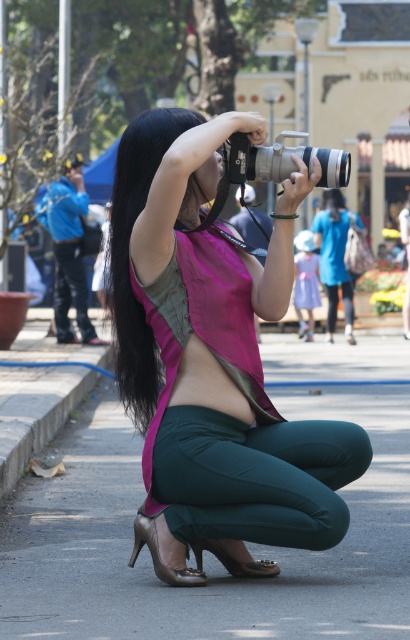
Does pink matte vest at center appear on the left side of blue denim jeans at center?

Yes, pink matte vest at center is to the left of blue denim jeans at center.

Is pink matte vest at center thinner than blue denim jeans at center?

In fact, pink matte vest at center might be wider than blue denim jeans at center.

Locate an element on the screen. This screenshot has width=410, height=640. pink matte vest at center is located at coordinates (211, 362).

Is blue denim jeans at center bigger than purple satin dress at upper center?

Yes, blue denim jeans at center is bigger than purple satin dress at upper center.

Which of these two, blue denim jeans at center or purple satin dress at upper center, stands shorter?

purple satin dress at upper center

The image size is (410, 640). Describe the element at coordinates (334, 259) in the screenshot. I see `blue denim jeans at center` at that location.

Find the location of a particular element. This screenshot has height=640, width=410. blue denim jeans at center is located at coordinates (334, 259).

Can you confirm if concrete at lower left is wider than purple satin dress at upper center?

Yes.

Is point (32, 420) farther from camera compared to point (309, 282)?

No.

Between point (16, 467) and point (312, 323), which one is positioned behind?

The point (312, 323) is more distant.

Image resolution: width=410 pixels, height=640 pixels. Identify the location of concrete at lower left. (34, 412).